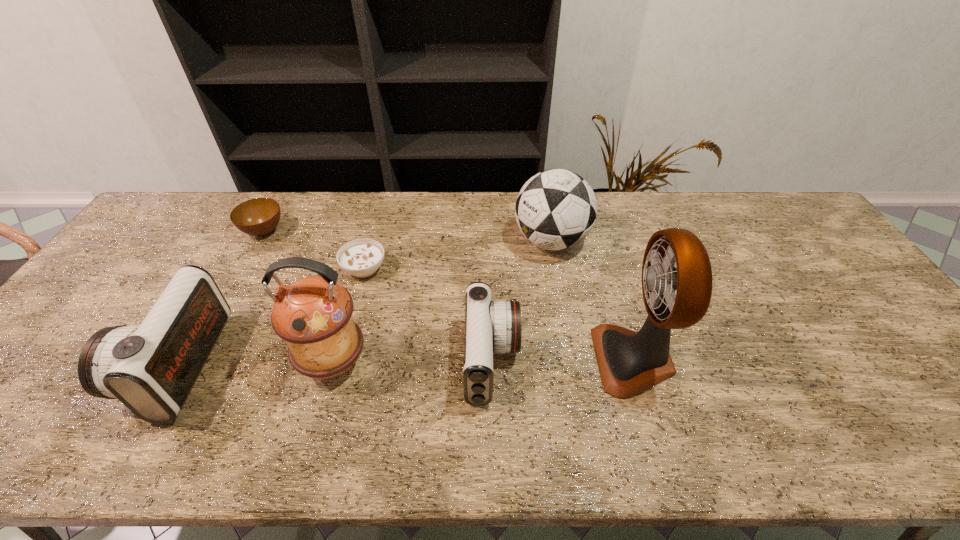
Observe the arrangement of all camcorders in the image. To keep them evenly spaced, where would you place another camcorder on the right? Please locate a free space. Please provide its 2D coordinates. Your answer should be formatted as a tuple, i.e. [(x, y)], where the tuple contains the x and y coordinates of a point satisfying the conditions above.

[(802, 358)]